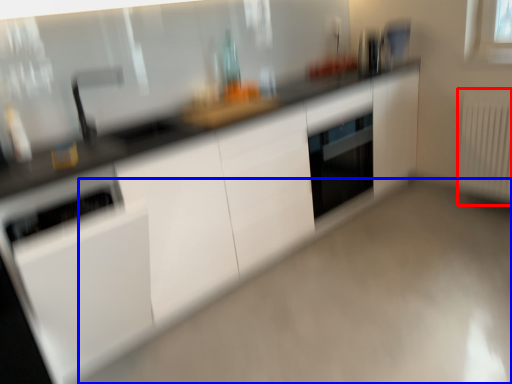
Question: Which object appears closest to the camera in this image, radiator (highlighted by a red box) or plain (highlighted by a blue box)?

Choices:
 (A) radiator
 (B) plain

Answer: (B)